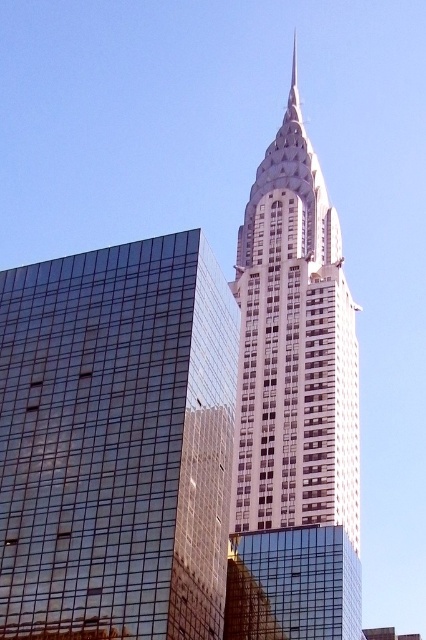
You are an architect analyzing the central area of the image. You observe the glassy reflective skyscraper at center and the white glass tower at center. Which of these two structures has a narrower width?

The glassy reflective skyscraper at center has a narrower width than the white glass tower at center according to the description.

You are an architect analyzing the skyline of a city. You observe the glassy reflective skyscraper at center and the white glass tower at center. Which of these two structures appears lower in the scene?

The glassy reflective skyscraper at center appears lower because it is positioned below the white glass tower at center.